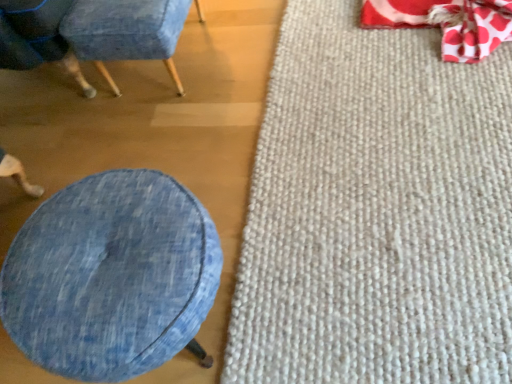
Question: Considering the relative positions of red polka dot fabric bean bag chair at upper right and denim fabric chair at upper left, the first chair in the right-to-left sequence, in the image provided, is red polka dot fabric bean bag chair at upper right to the left or to the right of denim fabric chair at upper left, the first chair in the right-to-left sequence,?

Choices:
 (A) left
 (B) right

Answer: (B)

Question: Considering the positions of point (484, 56) and point (113, 36), is point (484, 56) closer or farther from the camera than point (113, 36)?

Choices:
 (A) closer
 (B) farther

Answer: (B)

Question: Based on their relative distances, which object is nearer to the denim fabric chair at upper left, the first chair in the right-to-left sequence?

Choices:
 (A) red polka dot fabric bean bag chair at upper right
 (B) denim fabric ottoman at lower left
 (C) denim fabric at left, which appears as the 2th chair when viewed from the right
 (D) white textured mat at right

Answer: (C)

Question: Estimate the real-world distances between objects in this image. Which object is closer to the red polka dot fabric bean bag chair at upper right?

Choices:
 (A) denim fabric at left, which appears as the 2th chair when viewed from the right
 (B) denim fabric chair at upper left, the first chair in the right-to-left sequence
 (C) denim fabric ottoman at lower left
 (D) white textured mat at right

Answer: (D)